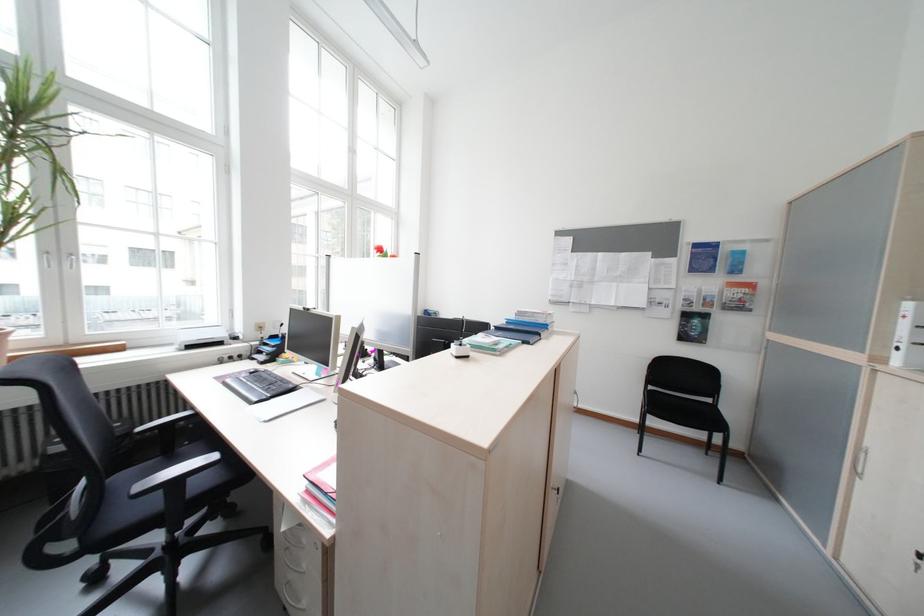
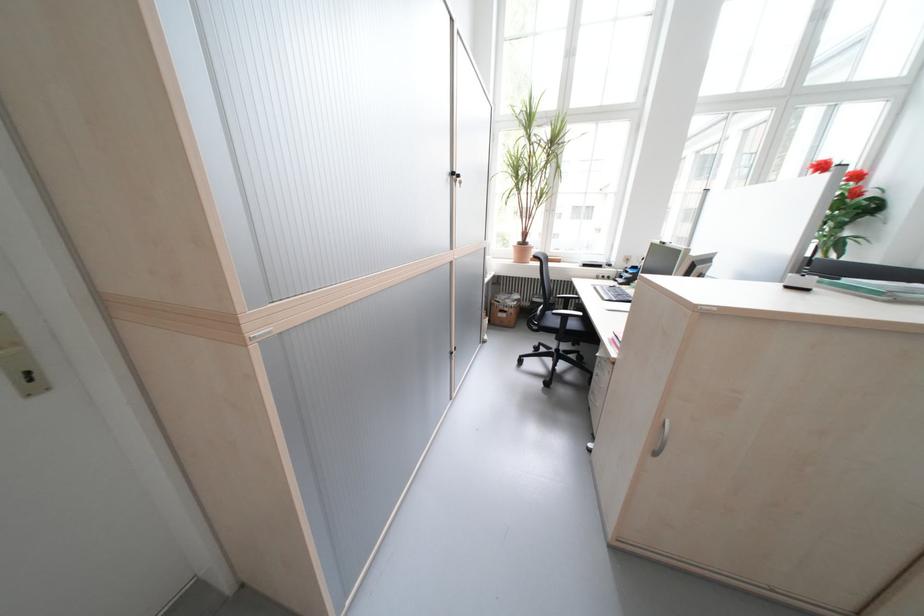
How did the camera likely rotate?

The camera's rotation is toward left-down.